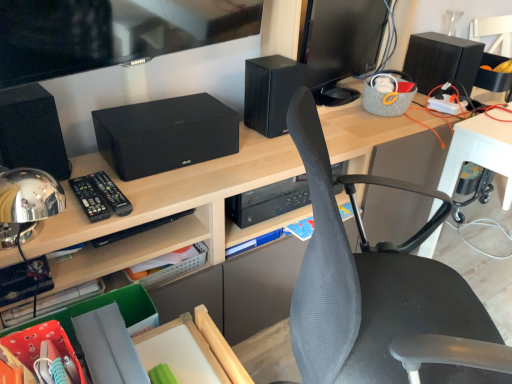
Question: Is black matte speaker at upper right, placed as the first speaker when sorted from back to front, positioned beyond the bounds of black matte speaker at center, the 2th speaker in the left-to-right sequence?

Choices:
 (A) yes
 (B) no

Answer: (A)

Question: Is black matte speaker at upper right, placed as the first speaker when sorted from back to front, oriented towards black matte speaker at center, which ranks as the 2th speaker in front-to-back order?

Choices:
 (A) yes
 (B) no

Answer: (B)

Question: Is black matte speaker at upper right, the third speaker from the left, taller than black matte speaker at center, the second speaker from the right?

Choices:
 (A) yes
 (B) no

Answer: (A)

Question: Is black matte speaker at upper right, placed as the first speaker when sorted from back to front, smaller than black matte speaker at center, positioned as the 2th speaker in back-to-front order?

Choices:
 (A) yes
 (B) no

Answer: (B)

Question: Is black matte speaker at upper right, which appears as the 1th speaker when viewed from the right, not near black matte speaker at center, which ranks as the 2th speaker in front-to-back order?

Choices:
 (A) no
 (B) yes

Answer: (A)

Question: Could black matte speaker at center, the 2th speaker in the left-to-right sequence, be considered to be inside black matte speaker at upper right, placed as the first speaker when sorted from back to front?

Choices:
 (A) yes
 (B) no

Answer: (B)

Question: Can you confirm if black plastic remote at left, which appears as the 1th control when viewed from the left, is taller than black matte speaker at upper left, which appears as the first speaker when viewed from the left?

Choices:
 (A) no
 (B) yes

Answer: (A)

Question: From the image's perspective, would you say black plastic remote at left, which appears as the 1th control when viewed from the left, is positioned over black matte speaker at upper left, which appears as the first speaker when viewed from the left?

Choices:
 (A) yes
 (B) no

Answer: (B)

Question: Is black matte speaker at upper left, acting as the 1th speaker starting from the front, surrounded by black plastic remote at left, the second control positioned from the right?

Choices:
 (A) no
 (B) yes

Answer: (A)

Question: From the image's perspective, is black plastic remote at left, which appears as the 1th control when viewed from the left, below black matte speaker at upper left, positioned as the third speaker in back-to-front order?

Choices:
 (A) no
 (B) yes

Answer: (B)

Question: Can you confirm if black plastic remote at left, which appears as the 1th control when viewed from the left, is positioned to the right of black matte speaker at upper left, positioned as the third speaker in back-to-front order?

Choices:
 (A) yes
 (B) no

Answer: (A)

Question: Is black plastic remote at left, the second control positioned from the right, further to the viewer compared to black matte speaker at upper left, which appears as the first speaker when viewed from the left?

Choices:
 (A) no
 (B) yes

Answer: (B)

Question: Is black matte speaker at center, positioned as the 2th speaker in back-to-front order, smaller than black plastic remote at left, which appears as the 1th control when viewed from the left?

Choices:
 (A) yes
 (B) no

Answer: (B)